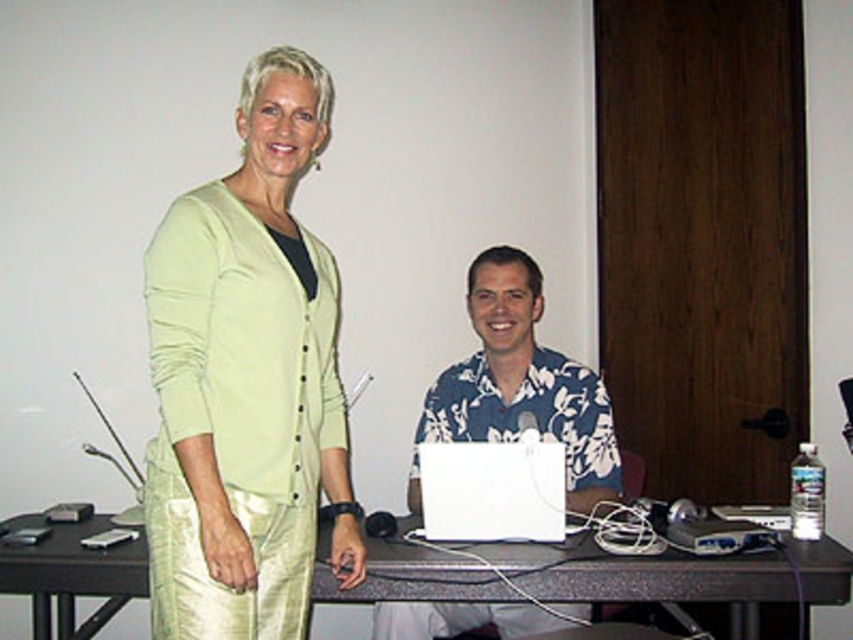
Is matte green cardigan at upper left to the left of light green fabric cardigan at upper left from the viewer's perspective?

No, matte green cardigan at upper left is not to the left of light green fabric cardigan at upper left.

Does matte green cardigan at upper left have a larger size compared to light green fabric cardigan at upper left?

No.

Is point (186, 209) farther from viewer compared to point (264, 346)?

No, (186, 209) is in front of (264, 346).

You are a GUI agent. You are given a task and a screenshot of the screen. Output one action in this format:
    pyautogui.click(x=<x>, y=<y>)
    Task: Click on the matte green cardigan at upper left
    This screenshot has width=853, height=640.
    Given the screenshot: What is the action you would take?
    pyautogui.click(x=248, y=380)

Consider the image. Is matte green cardigan at upper left bigger than blue floral shirt at center?

Yes.

Is matte green cardigan at upper left to the left of blue floral shirt at center from the viewer's perspective?

Indeed, matte green cardigan at upper left is positioned on the left side of blue floral shirt at center.

Between point (302, 385) and point (469, 394), which one is positioned in front?

Point (302, 385)

I want to click on matte green cardigan at upper left, so click(248, 380).

Does light green fabric cardigan at upper left have a lesser width compared to smooth gray table at center?

Yes, light green fabric cardigan at upper left is thinner than smooth gray table at center.

Is point (265, 326) closer to viewer compared to point (24, 516)?

Yes, it is in front of point (24, 516).

At what (x,y) coordinates should I click in order to perform the action: click on light green fabric cardigan at upper left. Please return your answer as a coordinate pair (x, y). The height and width of the screenshot is (640, 853). Looking at the image, I should click on (247, 381).